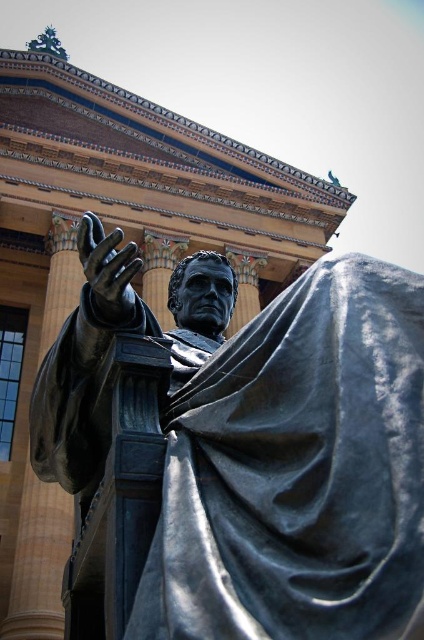
In the scene shown: Between bronze statue at center and shiny bronze hand at center, which one is positioned lower?

bronze statue at center is lower down.

Locate an element on the screen. The height and width of the screenshot is (640, 424). bronze statue at center is located at coordinates (292, 461).

Image resolution: width=424 pixels, height=640 pixels. What are the coordinates of `bronze statue at center` in the screenshot? It's located at (292, 461).